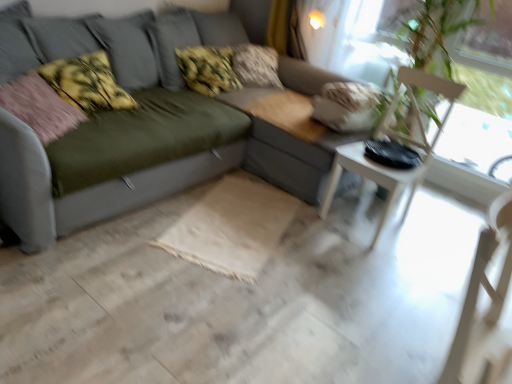
Question: From the image's perspective, is matte gray couch at center over fluffy beige pillow at upper center, the first pillow from the back?

Choices:
 (A) no
 (B) yes

Answer: (A)

Question: Does matte gray couch at center have a lesser width compared to fluffy beige pillow at upper center, the first pillow from the back?

Choices:
 (A) yes
 (B) no

Answer: (B)

Question: Does matte gray couch at center have a greater height compared to fluffy beige pillow at upper center, the 4th pillow in the front-to-back sequence?

Choices:
 (A) yes
 (B) no

Answer: (A)

Question: Does matte gray couch at center appear on the left side of fluffy beige pillow at upper center, the first pillow from the back?

Choices:
 (A) yes
 (B) no

Answer: (A)

Question: Does matte gray couch at center have a lesser height compared to fluffy beige pillow at upper center, the first pillow from the back?

Choices:
 (A) yes
 (B) no

Answer: (B)

Question: Considering the positions of fluffy yellow-green pillow at center, the 2th pillow when ordered from back to front, and transparent glass window screen at upper right in the image, is fluffy yellow-green pillow at center, the 2th pillow when ordered from back to front, wider or thinner than transparent glass window screen at upper right?

Choices:
 (A) thin
 (B) wide

Answer: (A)

Question: From a real-world perspective, is fluffy yellow-green pillow at center, which is the 3th pillow from front to back, physically located above or below transparent glass window screen at upper right?

Choices:
 (A) below
 (B) above

Answer: (A)

Question: Considering the positions of fluffy yellow-green pillow at center, the 2th pillow when ordered from back to front, and transparent glass window screen at upper right in the image, is fluffy yellow-green pillow at center, the 2th pillow when ordered from back to front, bigger or smaller than transparent glass window screen at upper right?

Choices:
 (A) small
 (B) big

Answer: (A)

Question: Visually, is fluffy yellow-green pillow at center, the 2th pillow when ordered from back to front, positioned to the left or to the right of transparent glass window screen at upper right?

Choices:
 (A) left
 (B) right

Answer: (A)

Question: From the image's perspective, is fluffy pink pillow at left, marked as the 2th pillow in a front-to-back arrangement, above or below white wood armchair at right, placed as the second armchair when sorted from back to front?

Choices:
 (A) below
 (B) above

Answer: (B)

Question: Choose the correct answer: Is fluffy pink pillow at left, the 3th pillow in the back-to-front sequence, inside white wood armchair at right, placed as the second armchair when sorted from back to front, or outside it?

Choices:
 (A) inside
 (B) outside

Answer: (B)

Question: From a real-world perspective, is fluffy pink pillow at left, marked as the 2th pillow in a front-to-back arrangement, physically located above or below white wood armchair at right, placed as the second armchair when sorted from back to front?

Choices:
 (A) above
 (B) below

Answer: (A)

Question: Based on their positions, is fluffy pink pillow at left, the 3th pillow in the back-to-front sequence, located to the left or right of white wood armchair at right, placed as the second armchair when sorted from back to front?

Choices:
 (A) left
 (B) right

Answer: (A)

Question: From a real-world perspective, is transparent glass window screen at upper right above or below fluffy beige pillow at upper center, the 4th pillow in the front-to-back sequence?

Choices:
 (A) below
 (B) above

Answer: (B)

Question: Visually, is transparent glass window screen at upper right positioned to the left or to the right of fluffy beige pillow at upper center, the first pillow from the back?

Choices:
 (A) left
 (B) right

Answer: (B)